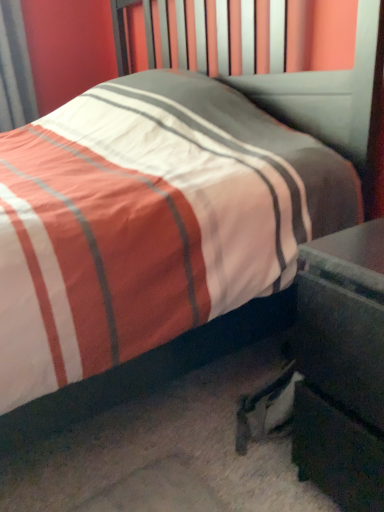
Question: Should I look upward or downward to see black glossy nightstand at lower right?

Choices:
 (A) down
 (B) up

Answer: (A)